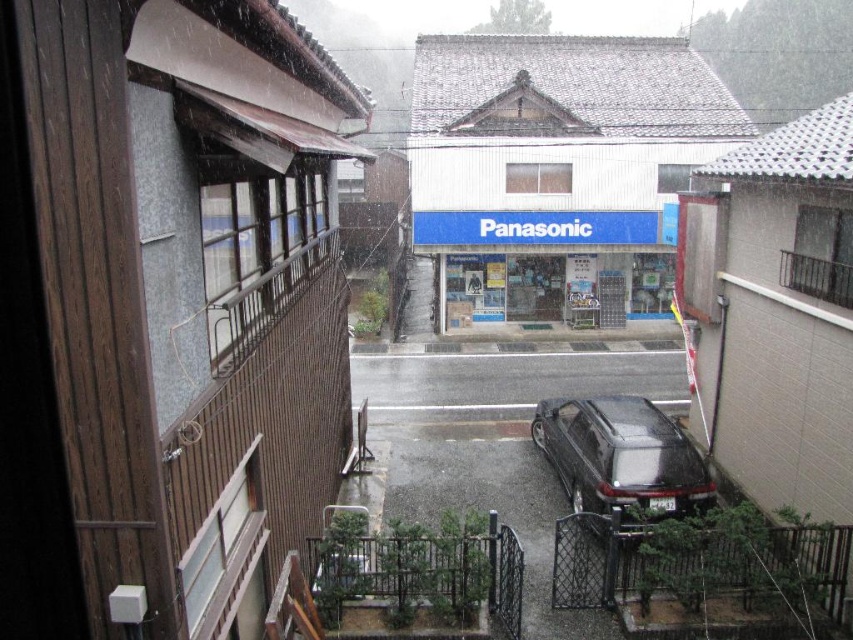
Does point (44, 269) lie behind point (634, 401)?

That is False.

Is point (115, 538) less distant than point (650, 506)?

Yes, point (115, 538) is in front of point (650, 506).

This screenshot has height=640, width=853. In order to click on brown wood building at left in this screenshot , I will do `click(189, 294)`.

Does brown wood building at left have a smaller size compared to white matte building at center?

Yes, brown wood building at left is smaller than white matte building at center.

Who is lower down, brown wood building at left or white matte building at center?

brown wood building at left is lower down.

Is point (132, 35) more distant than point (634, 74)?

No, it is in front of (634, 74).

Locate an element on the screen. brown wood building at left is located at coordinates (189, 294).

Is white matte building at center thinner than glossy black car at lower center?

In fact, white matte building at center might be wider than glossy black car at lower center.

Is white matte building at center shorter than glossy black car at lower center?

In fact, white matte building at center may be taller than glossy black car at lower center.

This screenshot has width=853, height=640. I want to click on white matte building at center, so click(x=558, y=170).